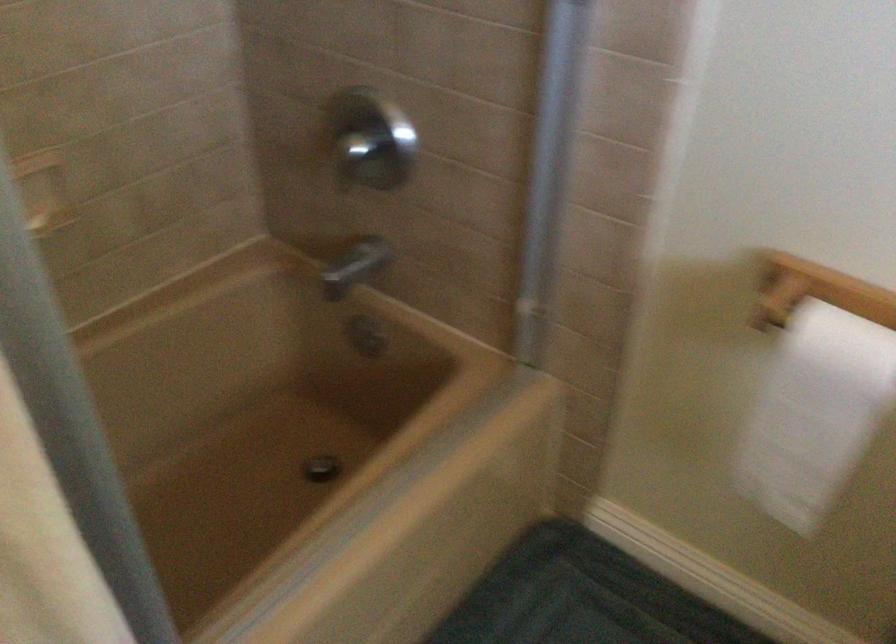
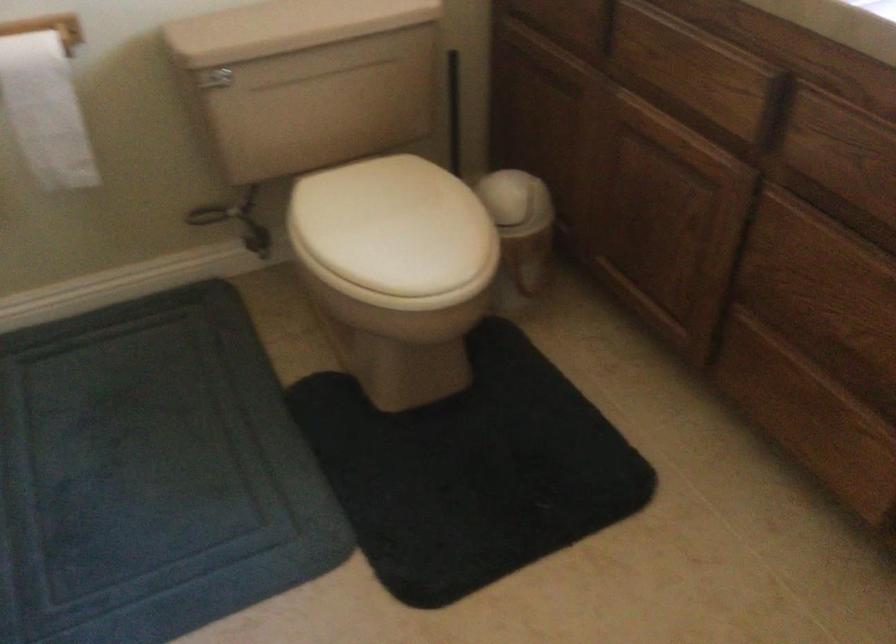
How did the camera likely rotate?

The camera rotated toward right-down.